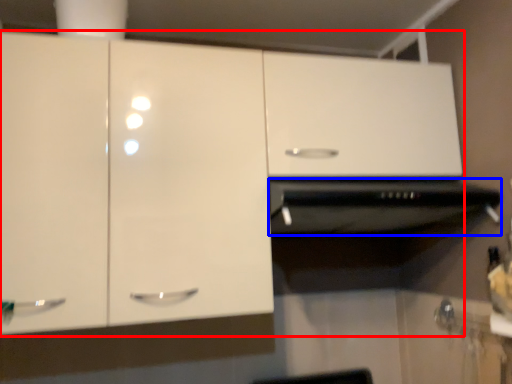
Question: Which object is further to the camera taking this photo, cabinetry (highlighted by a red box) or vent (highlighted by a blue box)?

Choices:
 (A) cabinetry
 (B) vent

Answer: (B)